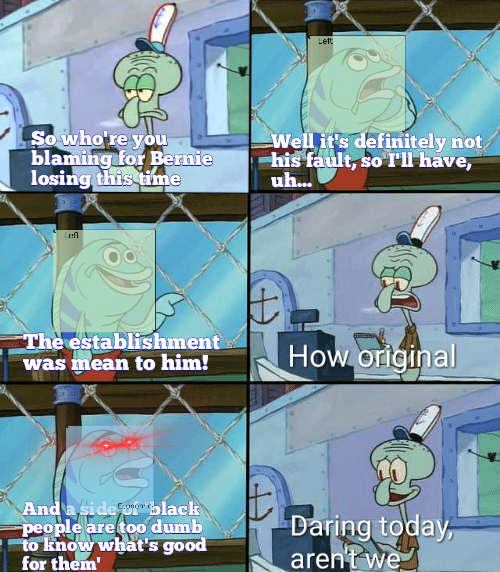
Where is `window`? window is located at coordinates (484, 475).